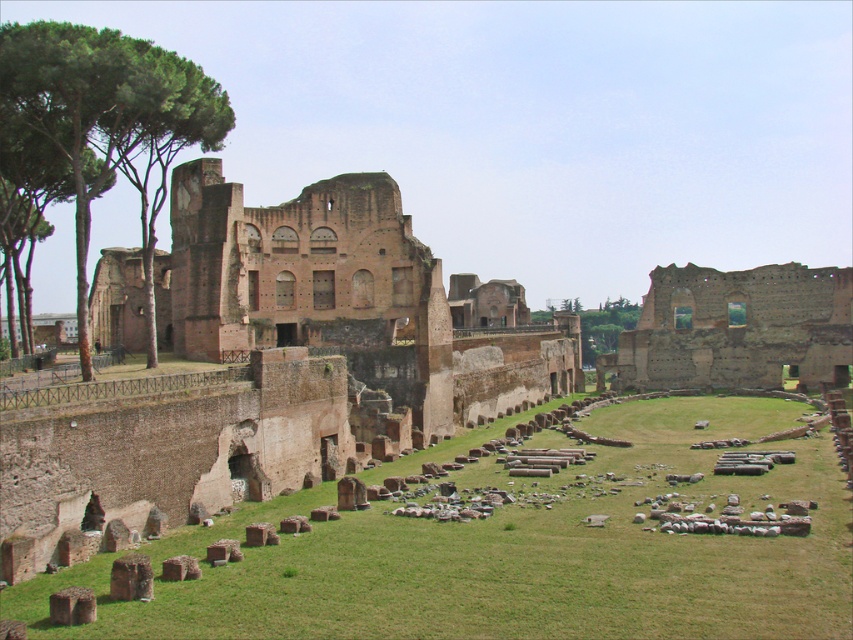
What do you see at coordinates (735, 328) in the screenshot? I see `brown stone ruins at center right` at bounding box center [735, 328].

Is brown stone ruins at center right in front of green leafy tree at center?

Yes, it is.

Where is `brown stone ruins at center right`? This screenshot has width=853, height=640. brown stone ruins at center right is located at coordinates (735, 328).

Identify the location of brown stone ruins at center right. (735, 328).

Is point (492, 528) positioned behind point (611, 324)?

No.

Who is more forward, (x=70, y=570) or (x=614, y=304)?

Point (x=70, y=570) is in front.

Does point (529, 518) come closer to viewer compared to point (598, 348)?

Yes.

Where is `green grass at center`? This screenshot has width=853, height=640. green grass at center is located at coordinates (515, 554).

Can you confirm if green grass at center is positioned to the left of green leafy tree at upper left?

In fact, green grass at center is to the right of green leafy tree at upper left.

Is point (120, 634) farther from viewer compared to point (26, 72)?

No.

The width and height of the screenshot is (853, 640). In order to click on green grass at center in this screenshot , I will do `click(515, 554)`.